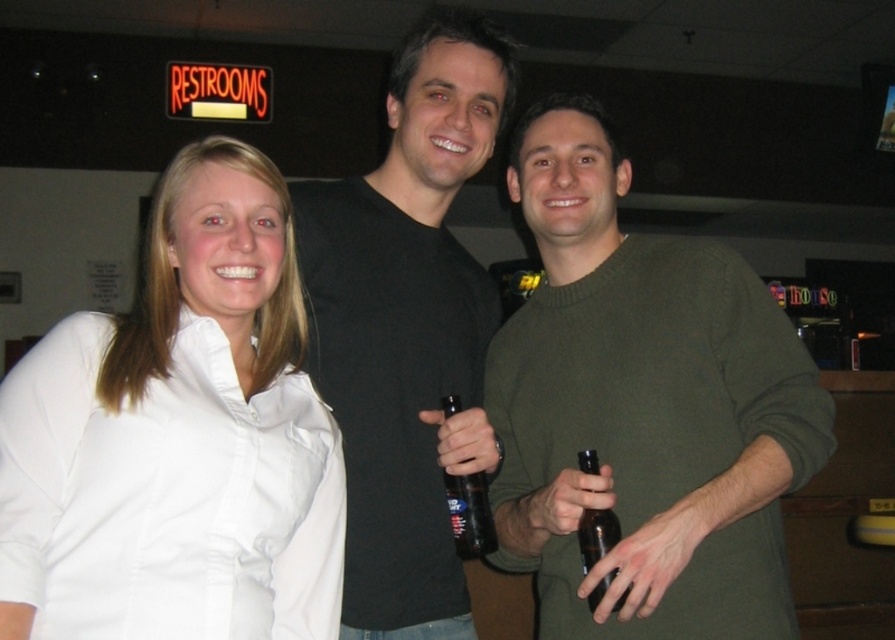
Question: Which of the following is the farthest from the observer?

Choices:
 (A) white smooth shirt at left
 (B) black glass bottle at center
 (C) black matte shirt at center
 (D) brown glass bottle at center

Answer: (B)

Question: Which of the following is the farthest from the observer?

Choices:
 (A) green matte sweater at center
 (B) white smooth shirt at left
 (C) black glass bottle at center

Answer: (C)

Question: Can you confirm if green matte sweater at center is bigger than black matte shirt at center?

Choices:
 (A) no
 (B) yes

Answer: (B)

Question: Is white smooth shirt at left further to camera compared to black glass bottle at center?

Choices:
 (A) no
 (B) yes

Answer: (A)

Question: Which point appears closest to the camera in this image?

Choices:
 (A) (614, 202)
 (B) (589, 518)
 (C) (48, 385)
 (D) (463, 552)

Answer: (C)

Question: Considering the relative positions of green matte sweater at center and brown glass bottle at center in the image provided, where is green matte sweater at center located with respect to brown glass bottle at center?

Choices:
 (A) below
 (B) above

Answer: (B)